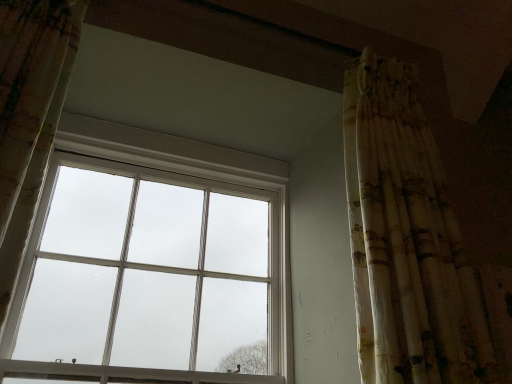
Measure the distance between printed fabric curtain at right and camera.

The depth of printed fabric curtain at right is 37.40 inches.

This screenshot has width=512, height=384. What are the coordinates of `printed fabric curtain at right` in the screenshot? It's located at [x=413, y=245].

The height and width of the screenshot is (384, 512). Describe the element at coordinates (413, 245) in the screenshot. I see `printed fabric curtain at right` at that location.

I want to click on printed fabric curtain at right, so click(413, 245).